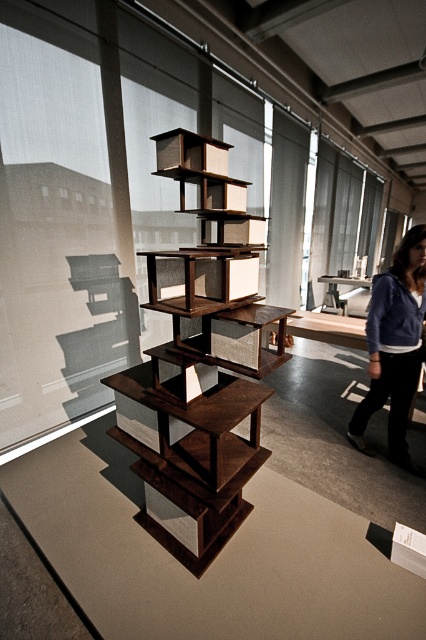
Which is in front, point (155, 515) or point (356, 412)?

Point (155, 515)

This screenshot has height=640, width=426. I want to click on dark brown wood bookshelf at center, so click(x=201, y=365).